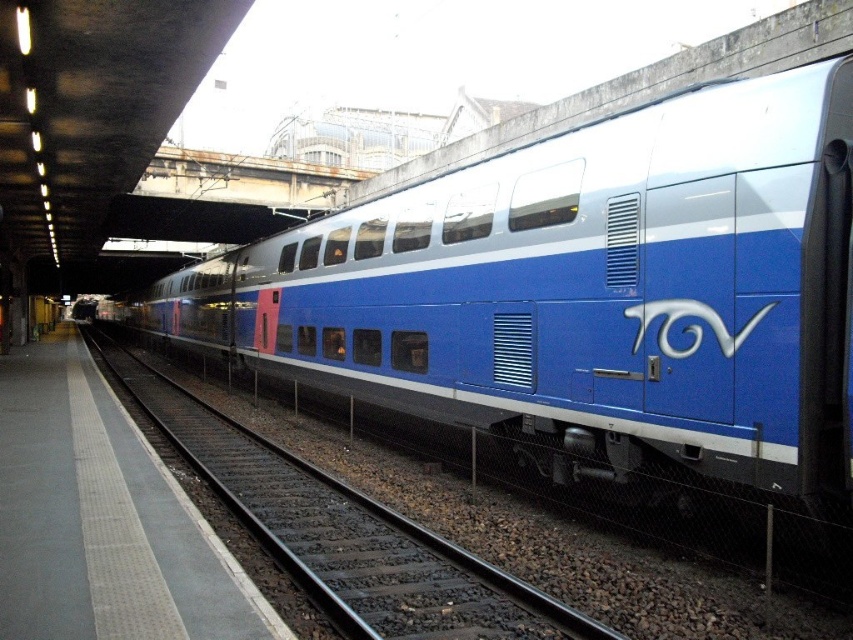
You are a passenger waiting at the train station platform. You see the blue metallic train at center and the metal track at center. Which object is closer to the edge of the platform?

The blue metallic train at center is positioned on the right side of metal track at center, so the metal track at center is closer to the edge of the platform since it is positioned to the left of the train.

You are a station engineer who needs to ensure the blue metallic train at center can fit on the metal track at center. Based on the scene, can you confirm if the train will fit on the track?

The blue metallic train at center is bigger than metal track at center, so it will not fit properly on the track.